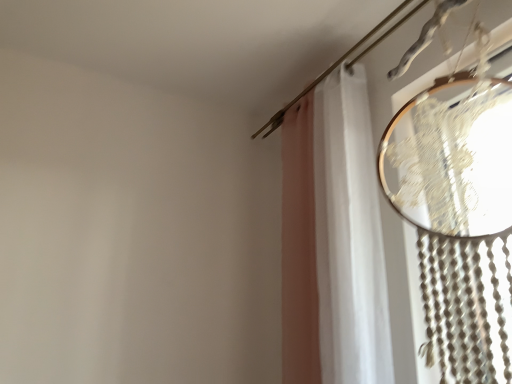
Question: Would you say white sheer curtain at upper right is inside or outside white fabric curtain at right?

Choices:
 (A) inside
 (B) outside

Answer: (B)

Question: In the image, is white sheer curtain at upper right on the left side or the right side of white fabric curtain at right?

Choices:
 (A) right
 (B) left

Answer: (B)

Question: In terms of width, does white sheer curtain at upper right look wider or thinner when compared to white fabric curtain at right?

Choices:
 (A) thin
 (B) wide

Answer: (A)

Question: From their relative heights in the image, would you say white fabric curtain at right is taller or shorter than white sheer curtain at upper right?

Choices:
 (A) tall
 (B) short

Answer: (B)

Question: In the image, is white fabric curtain at right positioned in front of or behind white sheer curtain at upper right?

Choices:
 (A) behind
 (B) front

Answer: (B)

Question: Considering the relative positions of white fabric curtain at right and white sheer curtain at upper right in the image provided, is white fabric curtain at right to the left or to the right of white sheer curtain at upper right?

Choices:
 (A) left
 (B) right

Answer: (B)

Question: From the image's perspective, relative to white sheer curtain at upper right, is white fabric curtain at right above or below?

Choices:
 (A) below
 (B) above

Answer: (B)